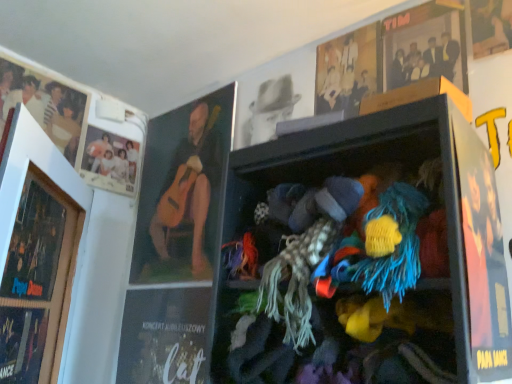
Question: Is matte black photo frame at upper left, placed as the fourth person when sorted from right to left, positioned with its back to matte white photo at upper left, the second person from the left?

Choices:
 (A) yes
 (B) no

Answer: (B)

Question: From the image's perspective, is matte black photo frame at upper left, placed as the fourth person when sorted from right to left, located beneath matte white photo at upper left, the 3th person in the right-to-left sequence?

Choices:
 (A) yes
 (B) no

Answer: (B)

Question: From a real-world perspective, is matte black photo frame at upper left, placed as the fourth person when sorted from right to left, under matte white photo at upper left, the second person from the left?

Choices:
 (A) yes
 (B) no

Answer: (B)

Question: Is matte black photo frame at upper left, placed as the fourth person when sorted from right to left, closer to camera compared to matte white photo at upper left, the 3th person in the right-to-left sequence?

Choices:
 (A) yes
 (B) no

Answer: (A)

Question: From a real-world perspective, is matte black photo frame at upper left, which is the first person in left-to-right order, located higher than matte white photo at upper left, the second person from the left?

Choices:
 (A) no
 (B) yes

Answer: (B)

Question: Could you tell me if matte black photo frame at upper left, which is the first person in left-to-right order, is turned towards matte white photo at upper left, the second person from the left?

Choices:
 (A) no
 (B) yes

Answer: (A)

Question: Can you confirm if wooden picture frame at left is positioned to the left of matte black photo frame at upper left, placed as the fourth person when sorted from right to left?

Choices:
 (A) no
 (B) yes

Answer: (A)

Question: Does wooden picture frame at left have a lesser width compared to matte black photo frame at upper left, placed as the fourth person when sorted from right to left?

Choices:
 (A) yes
 (B) no

Answer: (B)

Question: Is wooden picture frame at left touching matte black photo frame at upper left, placed as the fourth person when sorted from right to left?

Choices:
 (A) yes
 (B) no

Answer: (B)

Question: Is wooden picture frame at left wider than matte black photo frame at upper left, which is the first person in left-to-right order?

Choices:
 (A) no
 (B) yes

Answer: (B)

Question: Is wooden picture frame at left taller than matte black photo frame at upper left, which is the first person in left-to-right order?

Choices:
 (A) yes
 (B) no

Answer: (A)

Question: Can matte black photo frame at upper left, placed as the fourth person when sorted from right to left, be found inside wooden picture frame at left?

Choices:
 (A) no
 (B) yes

Answer: (A)

Question: Is matte black magazine at lower left, positioned as the 2th magazine in right-to-left order, further to the viewer compared to wooden picture frame at left?

Choices:
 (A) yes
 (B) no

Answer: (A)